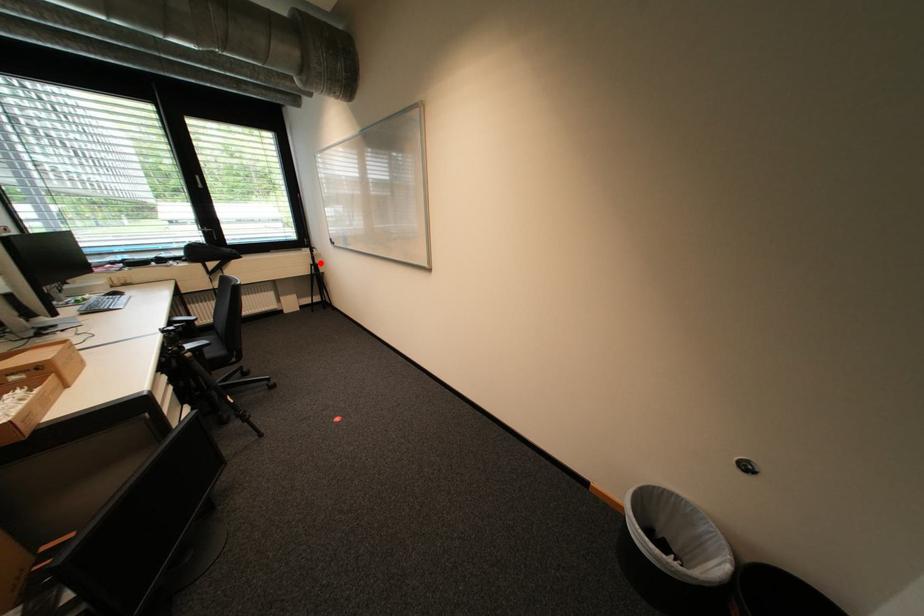
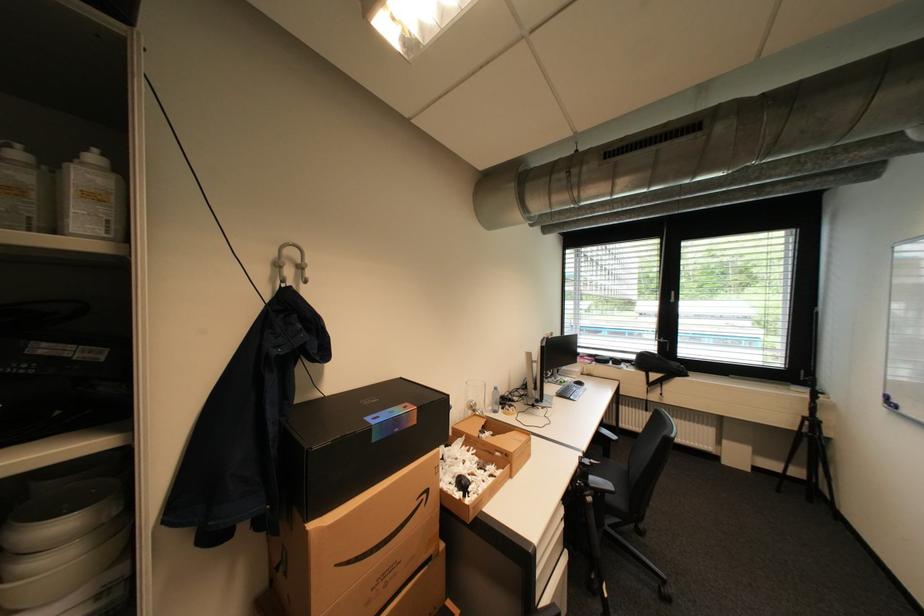
Where in the second image is the point corresponding to the highlighted location from the first image?

(815, 415)